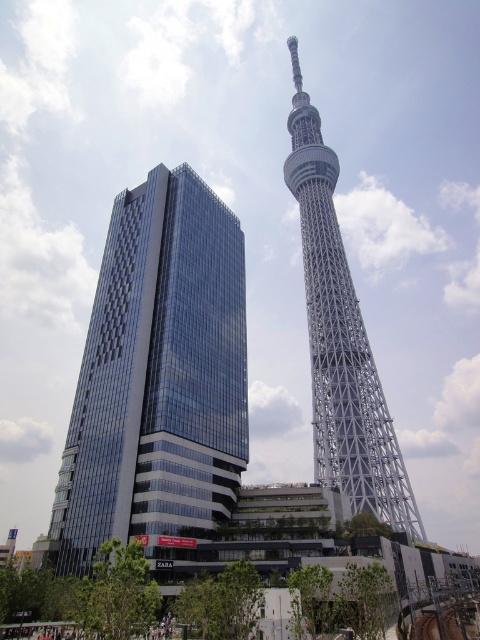
Question: Which object is positioned farthest from the white lattice tower at center?

Choices:
 (A) metallic gray train track at lower right
 (B) glassy modern building at center

Answer: (A)

Question: Can you confirm if glassy modern building at center is wider than white lattice tower at center?

Choices:
 (A) no
 (B) yes

Answer: (B)

Question: Does glassy modern building at center appear on the right side of metallic gray train track at lower right?

Choices:
 (A) yes
 (B) no

Answer: (B)

Question: Which point is farther to the camera?

Choices:
 (A) glassy modern building at center
 (B) white lattice tower at center

Answer: (B)

Question: Observing the image, what is the correct spatial positioning of glassy modern building at center in reference to metallic gray train track at lower right?

Choices:
 (A) below
 (B) above

Answer: (B)

Question: Which point appears closest to the camera in this image?

Choices:
 (A) [155, 484]
 (B) [437, 625]

Answer: (B)